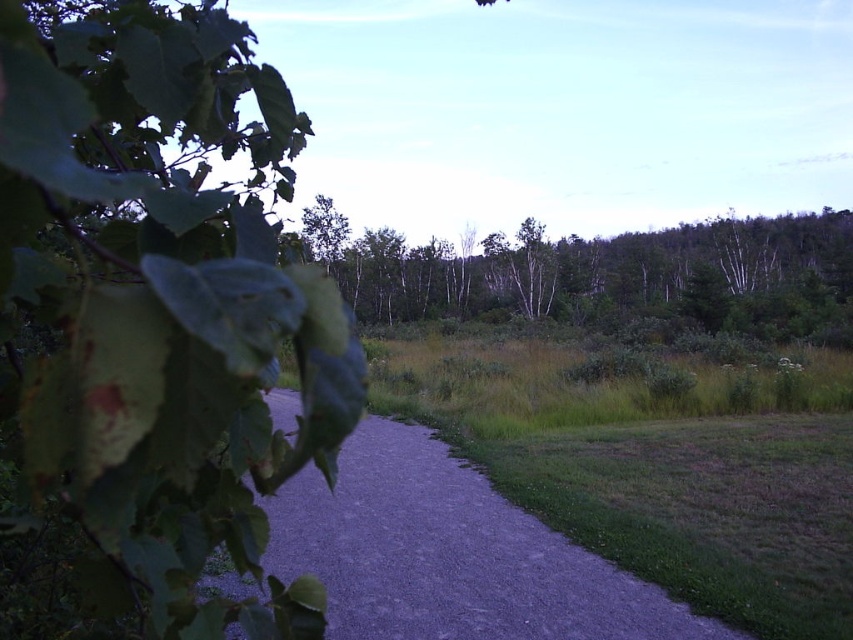
Question: Among these objects, which one is nearest to the camera?

Choices:
 (A) gray gravel path at center
 (B) green leafy tree at left

Answer: (B)

Question: Is green matte trees at upper center below green grass at center?

Choices:
 (A) yes
 (B) no

Answer: (B)

Question: Observing the image, what is the correct spatial positioning of green leafy tree at left in reference to green matte trees at upper center?

Choices:
 (A) left
 (B) right

Answer: (A)

Question: Can you confirm if gray gravel path at center is wider than green grass at center?

Choices:
 (A) no
 (B) yes

Answer: (A)

Question: Which point is farther to the camera?

Choices:
 (A) (207, 308)
 (B) (769, 289)
 (C) (550, 620)
 (D) (641, 403)

Answer: (B)

Question: Among these objects, which one is nearest to the camera?

Choices:
 (A) green leafy tree at left
 (B) gray gravel path at center
 (C) green matte trees at upper center
 (D) green grass at center

Answer: (A)